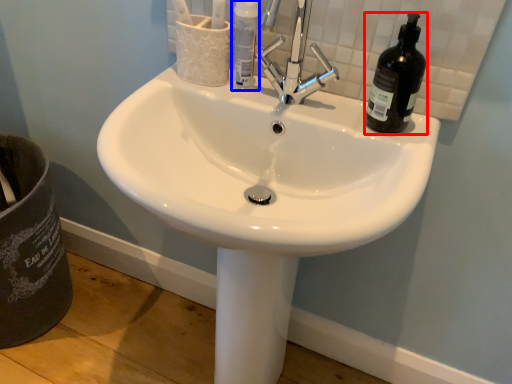
Question: Which point is closer to the camera, beer bottle (highlighted by a red box) or bottle (highlighted by a blue box)?

Choices:
 (A) beer bottle
 (B) bottle

Answer: (A)